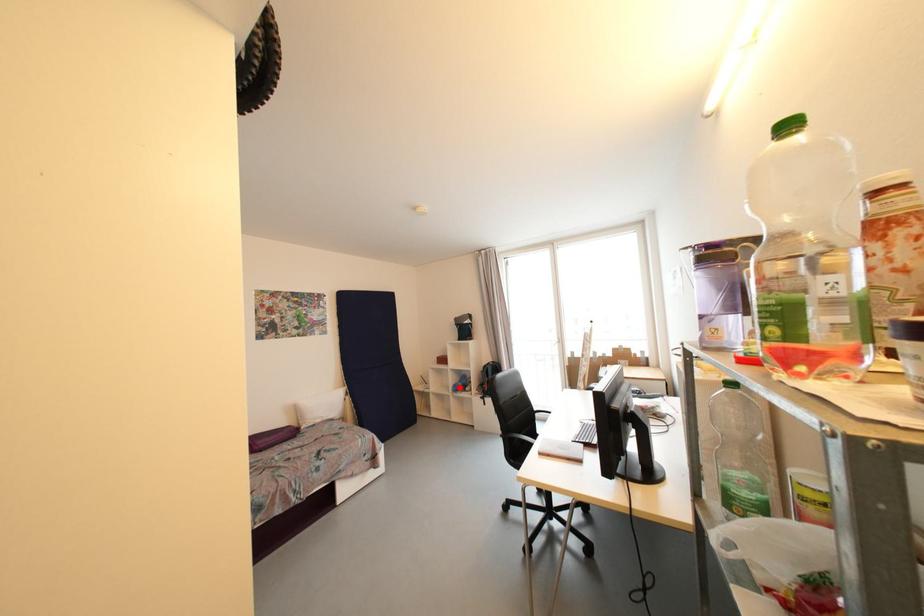
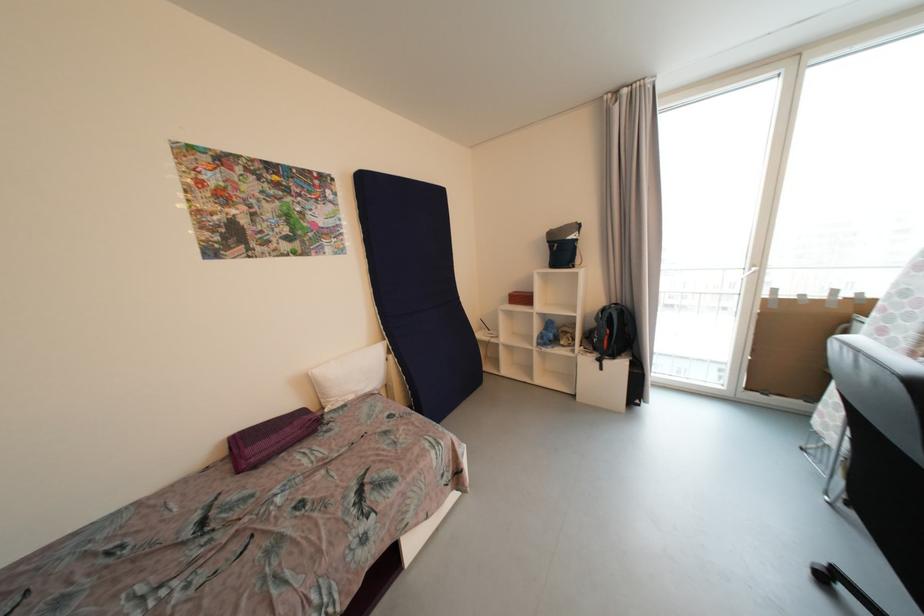
In the second image, find the point that corresponds to the highlighted location in the first image.

(545, 339)